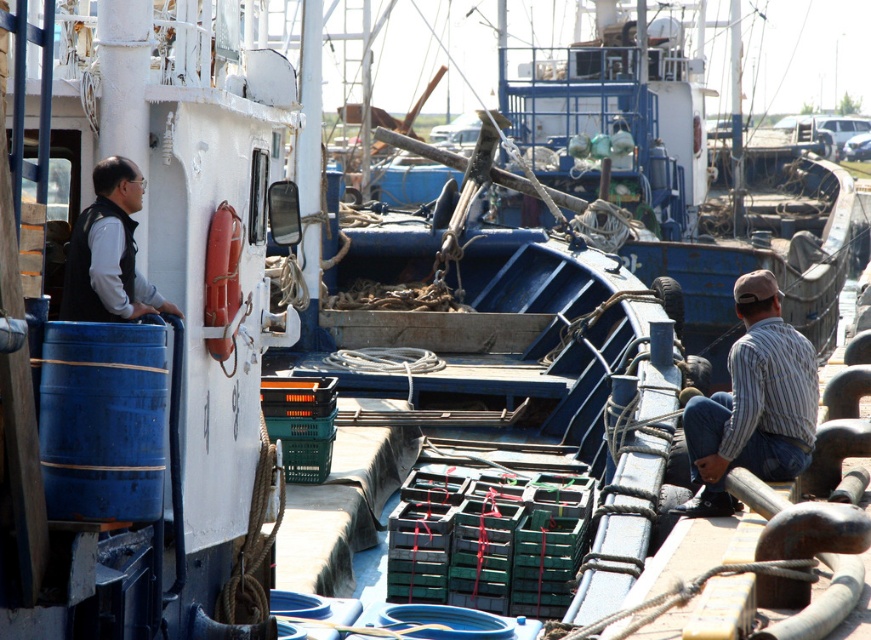
From the picture: Can you confirm if blue painted wood boat at center is shorter than striped cotton shirt at lower right?

Incorrect, blue painted wood boat at center's height does not fall short of striped cotton shirt at lower right's.

The width and height of the screenshot is (871, 640). I want to click on blue painted wood boat at center, so click(x=673, y=172).

Who is more distant from viewer, (x=709, y=355) or (x=753, y=378)?

Positioned behind is point (x=709, y=355).

The height and width of the screenshot is (640, 871). I want to click on blue painted wood boat at center, so click(673, 172).

Is blue painted wood boat at center behind black matte vest at left?

Yes.

Which is below, blue painted wood boat at center or black matte vest at left?

black matte vest at left

Between point (701, 339) and point (134, 202), which one is positioned in front?

Positioned in front is point (134, 202).

What are the coordinates of `blue painted wood boat at center` in the screenshot? It's located at (673, 172).

Which is behind, point (711, 451) or point (130, 177)?

Point (711, 451)

Between point (780, 356) and point (126, 236), which one is positioned in front?

Point (126, 236)

Identify the location of striped cotton shirt at lower right. (753, 403).